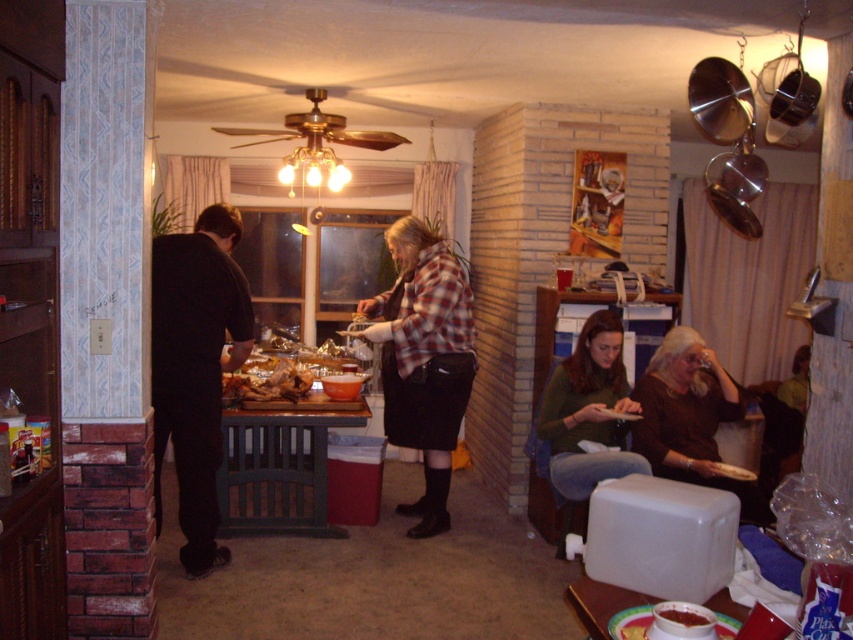
Question: Which point appears closest to the camera in this image?

Choices:
 (A) (577, 476)
 (B) (283, 368)
 (C) (160, 518)
 (D) (660, 449)

Answer: (A)

Question: Does black matte suit at left have a greater width compared to golden crispy chicken at center?

Choices:
 (A) no
 (B) yes

Answer: (B)

Question: Is golden crispy chicken at center thinner than smooth tomato soup at center?

Choices:
 (A) no
 (B) yes

Answer: (A)

Question: Is black matte suit at left wider than brown matte sweater at lower right?

Choices:
 (A) yes
 (B) no

Answer: (B)

Question: Among these points, which one is farthest from the camera?

Choices:
 (A) (196, 300)
 (B) (724, 486)
 (C) (592, 435)

Answer: (C)

Question: Which point is farther from the camera taking this photo?

Choices:
 (A) (680, 620)
 (B) (161, 403)
 (C) (392, 296)
 (D) (302, 385)

Answer: (C)